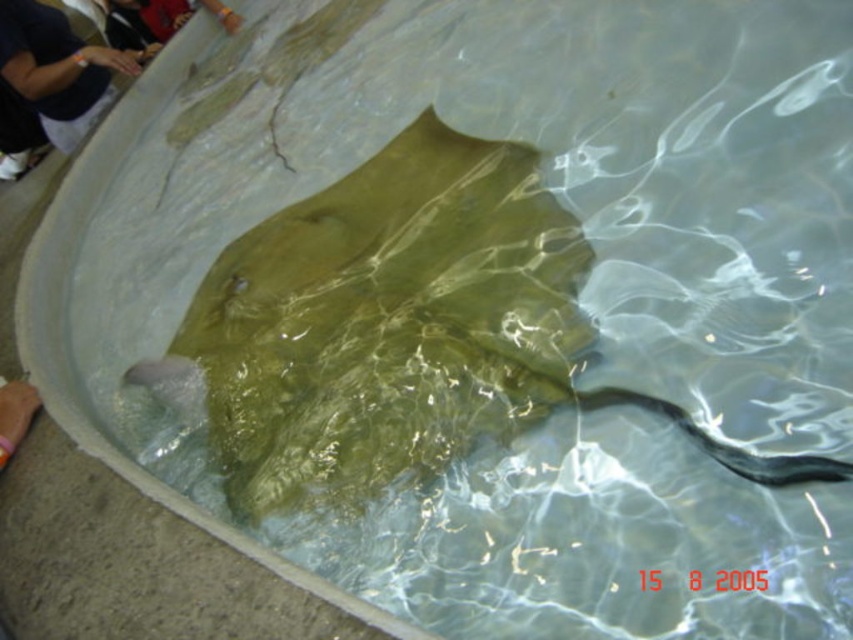
Question: Which object appears farthest from the camera in this image?

Choices:
 (A) greenish-brown glossy stingray at center
 (B) dark blue shirt at upper left

Answer: (B)

Question: Does greenish-brown glossy stingray at center have a lesser width compared to dark blue shirt at upper left?

Choices:
 (A) no
 (B) yes

Answer: (A)

Question: Is greenish-brown glossy stingray at center thinner than dark blue shirt at upper left?

Choices:
 (A) yes
 (B) no

Answer: (B)

Question: Where is greenish-brown glossy stingray at center located in relation to dark blue shirt at upper left in the image?

Choices:
 (A) below
 (B) above

Answer: (A)